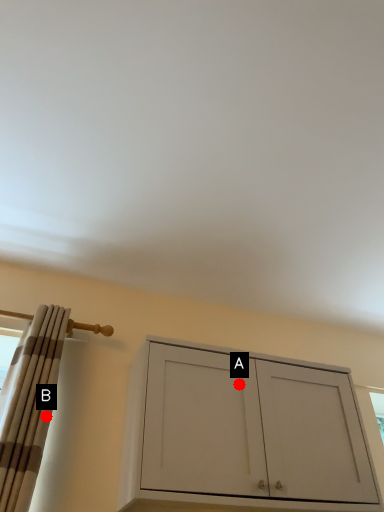
Question: Two points are circled on the image, labeled by A and B beside each circle. Which point appears closest to the camera in this image?

Choices:
 (A) A is closer
 (B) B is closer

Answer: (B)